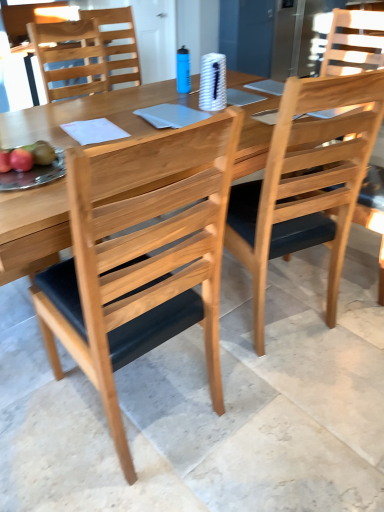
This screenshot has width=384, height=512. Describe the element at coordinates (27, 157) in the screenshot. I see `shiny red apple at left, the first fruit in the back-to-front sequence` at that location.

Describe the element at coordinates (110, 143) in the screenshot. The width and height of the screenshot is (384, 512). I see `natural wood table at center` at that location.

Describe the element at coordinates (118, 42) in the screenshot. I see `natural wood chair at upper left, acting as the 1th chair starting from the back` at that location.

Describe the element at coordinates (21, 160) in the screenshot. I see `shiny red apple at left, which appears as the 2th fruit when viewed from the back` at that location.

Locate an element on the screen. light brown wood chair at center, marked as the second chair in a back-to-front arrangement is located at coordinates (306, 183).

Is shiny red apple at left, arranged as the 1th fruit when viewed from the front, facing away from natural wood chair at center, which is the 1th chair from front to back?

No.

Would you say shiny red apple at left, arranged as the 1th fruit when viewed from the front, contains natural wood chair at center, which is the 1th chair from front to back?

No, natural wood chair at center, which is the 1th chair from front to back, is located outside of shiny red apple at left, arranged as the 1th fruit when viewed from the front.

Is shiny red apple at left, arranged as the 1th fruit when viewed from the front, to the left of natural wood chair at center, which is the 1th chair from front to back, from the viewer's perspective?

Yes.

Looking at their sizes, would you say shiny red apple at left, arranged as the 1th fruit when viewed from the front, is wider or thinner than natural wood chair at center, which is the 1th chair from front to back?

Considering their sizes, shiny red apple at left, arranged as the 1th fruit when viewed from the front, looks slimmer than natural wood chair at center, which is the 1th chair from front to back.

Can you confirm if shiny red apple at left, which appears as the 2th fruit when viewed from the back, is thinner than shiny red apple at left, which is counted as the second fruit, starting from the front?

Indeed, shiny red apple at left, which appears as the 2th fruit when viewed from the back, has a lesser width compared to shiny red apple at left, which is counted as the second fruit, starting from the front.

From a real-world perspective, relative to shiny red apple at left, which is counted as the second fruit, starting from the front, is shiny red apple at left, which appears as the 2th fruit when viewed from the back, vertically above or below?

shiny red apple at left, which appears as the 2th fruit when viewed from the back, is situated lower than shiny red apple at left, which is counted as the second fruit, starting from the front, in the real world.

Which of these two, shiny red apple at left, arranged as the 1th fruit when viewed from the front, or shiny red apple at left, the first fruit in the back-to-front sequence, is smaller?

shiny red apple at left, arranged as the 1th fruit when viewed from the front, is smaller.

Consider the image. Is shiny red apple at left, which appears as the 2th fruit when viewed from the back, positioned before shiny red apple at left, which is counted as the second fruit, starting from the front?

Yes, it is.

Which of these two, shiny red apple at left, the first fruit in the back-to-front sequence, or natural wood table at center, is wider?

natural wood table at center.

From the picture: Considering the relative sizes of shiny red apple at left, the first fruit in the back-to-front sequence, and natural wood table at center in the image provided, is shiny red apple at left, the first fruit in the back-to-front sequence, taller than natural wood table at center?

No, shiny red apple at left, the first fruit in the back-to-front sequence, is not taller than natural wood table at center.

From the image's perspective, is shiny red apple at left, the first fruit in the back-to-front sequence, above or below natural wood table at center?

shiny red apple at left, the first fruit in the back-to-front sequence, is above natural wood table at center.

What's the angular difference between shiny red apple at left, the first fruit in the back-to-front sequence, and natural wood table at center's facing directions?

The facing directions of shiny red apple at left, the first fruit in the back-to-front sequence, and natural wood table at center are 56.6 degrees apart.

Is shiny red apple at left, which is counted as the second fruit, starting from the front, not near natural wood chair at center, which is the 1th chair from front to back?

Actually, shiny red apple at left, which is counted as the second fruit, starting from the front, and natural wood chair at center, which is the 1th chair from front to back, are a little close together.

Is shiny red apple at left, which is counted as the second fruit, starting from the front, in front of or behind natural wood chair at center, which is the 1th chair from front to back, in the image?

In the image, shiny red apple at left, which is counted as the second fruit, starting from the front, appears behind natural wood chair at center, which is the 1th chair from front to back.

Considering the sizes of shiny red apple at left, which is counted as the second fruit, starting from the front, and natural wood chair at center, which is the 1th chair from front to back, in the image, is shiny red apple at left, which is counted as the second fruit, starting from the front, bigger or smaller than natural wood chair at center, which is the 1th chair from front to back,?

Considering their sizes, shiny red apple at left, which is counted as the second fruit, starting from the front, takes up less space than natural wood chair at center, which is the 1th chair from front to back.

From the image's perspective, which object appears higher, shiny red apple at left, which is counted as the second fruit, starting from the front, or natural wood chair at center, which is the 1th chair from front to back?

shiny red apple at left, which is counted as the second fruit, starting from the front, appears higher in the image.

From the image's perspective, which one is positioned lower, natural wood table at center or shiny red apple at left, which is counted as the second fruit, starting from the front?

natural wood table at center appears lower in the image.

Is natural wood table at center surrounding shiny red apple at left, which is counted as the second fruit, starting from the front?

Definitely not — shiny red apple at left, which is counted as the second fruit, starting from the front, is not inside natural wood table at center.

Between natural wood table at center and shiny red apple at left, the first fruit in the back-to-front sequence, which one is positioned behind?

shiny red apple at left, the first fruit in the back-to-front sequence, is behind.

Does natural wood table at center have a lesser height compared to shiny red apple at left, which is counted as the second fruit, starting from the front?

No, natural wood table at center is not shorter than shiny red apple at left, which is counted as the second fruit, starting from the front.

Based on their sizes in the image, would you say natural wood chair at upper left, acting as the 1th chair starting from the back, is bigger or smaller than natural wood chair at center, which is the 1th chair from front to back?

Clearly, natural wood chair at upper left, acting as the 1th chair starting from the back, is smaller in size than natural wood chair at center, which is the 1th chair from front to back.

Considering the relative sizes of natural wood chair at upper left, which is the third chair in front-to-back order, and natural wood chair at center, which is the 1th chair from front to back, in the image provided, is natural wood chair at upper left, which is the third chair in front-to-back order, thinner than natural wood chair at center, which is the 1th chair from front to back,?

Indeed, natural wood chair at upper left, which is the third chair in front-to-back order, has a lesser width compared to natural wood chair at center, which is the 1th chair from front to back.

Which chair is the 1st one when counting from the right side of the natural wood chair at upper left, which is the third chair in front-to-back order? Please provide its 2D coordinates.

[(140, 271)]

Considering the relative positions of natural wood chair at upper left, which is the third chair in front-to-back order, and natural wood chair at center, which is the 1th chair from front to back, in the image provided, is natural wood chair at upper left, which is the third chair in front-to-back order, to the right of natural wood chair at center, which is the 1th chair from front to back, from the viewer's perspective?

Incorrect, natural wood chair at upper left, which is the third chair in front-to-back order, is not on the right side of natural wood chair at center, which is the 1th chair from front to back.

Between natural wood chair at upper left, which is the third chair in front-to-back order, and shiny red apple at left, arranged as the 1th fruit when viewed from the front, which one appears on the left side from the viewer's perspective?

From the viewer's perspective, shiny red apple at left, arranged as the 1th fruit when viewed from the front, appears more on the left side.

Would you say natural wood chair at upper left, which is the third chair in front-to-back order, is outside shiny red apple at left, arranged as the 1th fruit when viewed from the front?

Yes.

Can you confirm if natural wood chair at upper left, acting as the 1th chair starting from the back, is bigger than shiny red apple at left, arranged as the 1th fruit when viewed from the front?

Yes, natural wood chair at upper left, acting as the 1th chair starting from the back, is bigger than shiny red apple at left, arranged as the 1th fruit when viewed from the front.

Locate an element on the screen. chair that is the 2nd one when counting rightward from the shiny red apple at left, which appears as the 2th fruit when viewed from the back is located at coordinates (140, 271).

This screenshot has width=384, height=512. In order to click on fruit below the shiny red apple at left, which is counted as the second fruit, starting from the front (from a real-world perspective) in this screenshot , I will do `click(21, 160)`.

Looking at the image, which one is located closer to natural wood chair at upper left, acting as the 1th chair starting from the back, shiny red apple at left, which is counted as the second fruit, starting from the front, or natural wood table at center?

natural wood table at center is positioned closer to the anchor natural wood chair at upper left, acting as the 1th chair starting from the back.

Which object lies further to the anchor point shiny red apple at left, which appears as the 2th fruit when viewed from the back, natural wood chair at upper left, acting as the 1th chair starting from the back, or light brown wood chair at center, acting as the second chair starting from the front?

natural wood chair at upper left, acting as the 1th chair starting from the back.

Estimate the real-world distances between objects in this image. Which object is closer to natural wood chair at center, which is the 1th chair from front to back, natural wood chair at upper left, which is the third chair in front-to-back order, or light brown wood chair at center, acting as the second chair starting from the front?

Among the two, light brown wood chair at center, acting as the second chair starting from the front, is located nearer to natural wood chair at center, which is the 1th chair from front to back.

Based on their spatial positions, is natural wood chair at upper left, which is the third chair in front-to-back order, or shiny red apple at left, arranged as the 1th fruit when viewed from the front, closer to natural wood chair at center, which is the 1th chair from front to back?

The object closer to natural wood chair at center, which is the 1th chair from front to back, is shiny red apple at left, arranged as the 1th fruit when viewed from the front.

When comparing their distances from natural wood table at center, does shiny red apple at left, which appears as the 2th fruit when viewed from the back, or natural wood chair at upper left, which is the third chair in front-to-back order, seem closer?

The object closer to natural wood table at center is shiny red apple at left, which appears as the 2th fruit when viewed from the back.

Estimate the real-world distances between objects in this image. Which object is closer to light brown wood chair at center, acting as the second chair starting from the front, shiny red apple at left, the first fruit in the back-to-front sequence, or natural wood chair at upper left, acting as the 1th chair starting from the back?

shiny red apple at left, the first fruit in the back-to-front sequence.

Which object lies nearer to the anchor point natural wood chair at center, which is the 1th chair from front to back, natural wood table at center or shiny red apple at left, the first fruit in the back-to-front sequence?

shiny red apple at left, the first fruit in the back-to-front sequence, lies closer to natural wood chair at center, which is the 1th chair from front to back, than the other object.

From the image, which object appears to be nearer to natural wood chair at upper left, which is the third chair in front-to-back order, natural wood table at center or natural wood chair at center, placed as the third chair when sorted from back to front?

natural wood table at center lies closer to natural wood chair at upper left, which is the third chair in front-to-back order, than the other object.

The height and width of the screenshot is (512, 384). I want to click on table between light brown wood chair at center, marked as the second chair in a back-to-front arrangement, and natural wood chair at upper left, which is the third chair in front-to-back order, from front to back, so click(110, 143).

Locate an element on the screen. fruit between shiny red apple at left, arranged as the 1th fruit when viewed from the front, and natural wood table at center from left to right is located at coordinates (27, 157).

You are a GUI agent. You are given a task and a screenshot of the screen. Output one action in this format:
    pyautogui.click(x=<x>, y=<y>)
    Task: Click on the fruit located between shiny red apple at left, arranged as the 1th fruit when viewed from the front, and light brown wood chair at center, marked as the second chair in a back-to-front arrangement, in the left-right direction
    The height and width of the screenshot is (512, 384).
    Given the screenshot: What is the action you would take?
    pyautogui.click(x=27, y=157)

Where is `fruit between natural wood chair at center, placed as the third chair when sorted from back to front, and shiny red apple at left, which is counted as the second fruit, starting from the front, along the z-axis`? The height and width of the screenshot is (512, 384). fruit between natural wood chair at center, placed as the third chair when sorted from back to front, and shiny red apple at left, which is counted as the second fruit, starting from the front, along the z-axis is located at coordinates (21, 160).